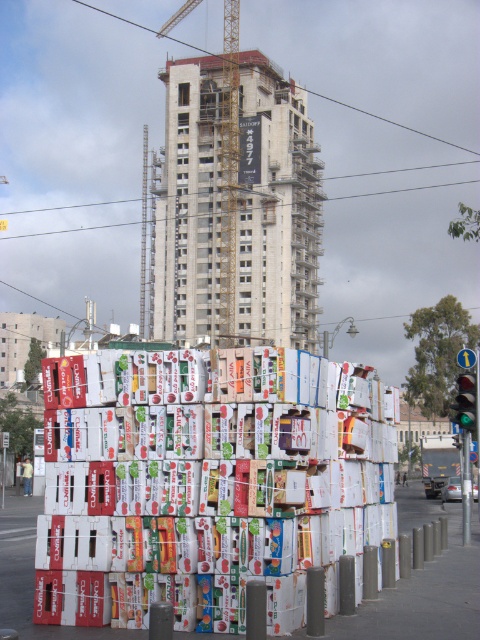
You are driving a car and see the green glass traffic light at center right. Can you determine its position relative to the large stack of colorful fruit boxes in the foreground?

The green glass traffic light at center right is located at point (466, 401), which is to the right and near the bottom of the image, placing it outside the area occupied by the large stack of colorful fruit boxes in the foreground.

You are a delivery driver who needs to back up your truck to load the fruit boxes. You see the yellow metal crane at upper center and the green glass traffic light at center right. Which object is closer to your truck so you can avoid hitting it while backing up?

The yellow metal crane at upper center is closer to your truck because it is further to the viewer than the green glass traffic light at center right, meaning it is physically nearer in proximity.

You are standing at the origin point in the urban scene. There are two points marked in the image. One is at coordinates point [232,296] and the other is at point [468,460]. Which of these two points is closer to you?

Point [468,460] is closer to you because it is in front of point [232,296] according to their spatial arrangement.